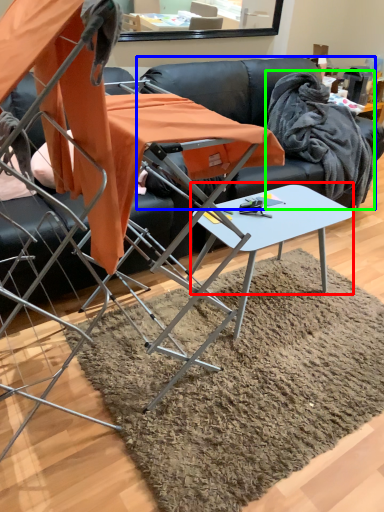
Question: Which is farther away from round table (highlighted by a red box)? couch (highlighted by a blue box) or fabric (highlighted by a green box)?

Choices:
 (A) couch
 (B) fabric

Answer: (B)